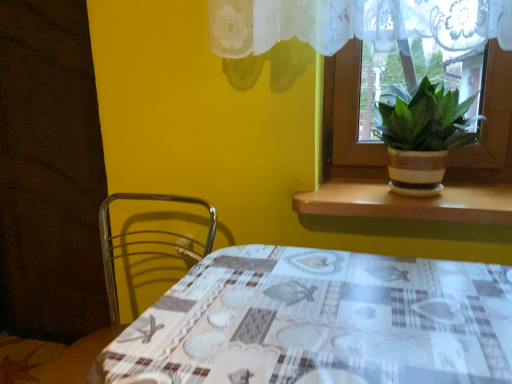
Question: Considering the positions of point (373, 188) and point (415, 160), is point (373, 188) closer or farther from the camera than point (415, 160)?

Choices:
 (A) closer
 (B) farther

Answer: (B)

Question: Considering the positions of brown wood at upper right and brown striped pot at window in the image, is brown wood at upper right bigger or smaller than brown striped pot at window?

Choices:
 (A) small
 (B) big

Answer: (A)

Question: Estimate the real-world distances between objects in this image. Which object is closer to the metallic wire chair at lower left?

Choices:
 (A) brown wood at upper right
 (B) brown striped pot at window
 (C) plaid fabric table at center

Answer: (C)

Question: Estimate the real-world distances between objects in this image. Which object is closer to the brown striped pot at window?

Choices:
 (A) brown wood at upper right
 (B) metallic wire chair at lower left
 (C) plaid fabric table at center

Answer: (A)